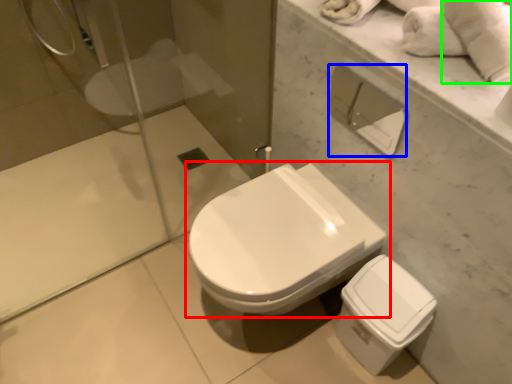
Question: Based on their relative distances, which object is nearer to toilet (highlighted by a red box)? Choose from toilet paper (highlighted by a blue box) and bath towel (highlighted by a green box).

Choices:
 (A) toilet paper
 (B) bath towel

Answer: (B)